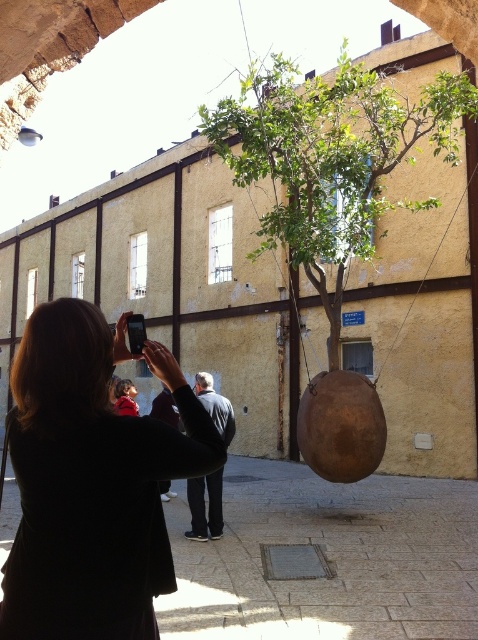
You are standing in front of the large beige building with dark brown horizontal lines. You see a point at coordinates [91,481]. What object is located at that point?

The point at coordinates [91,481] indicates the location of the matte black jacket at left.

You are a photographer trying to capture a group photo of the matte black jacket at left and the dark gray jacket at center. Which jacket should you focus on first if you want to ensure both are in frame without zooming in or out?

The matte black jacket at left is larger in size than the dark gray jacket at center, so you should focus on the matte black jacket at left first to ensure both are in frame without zooming.